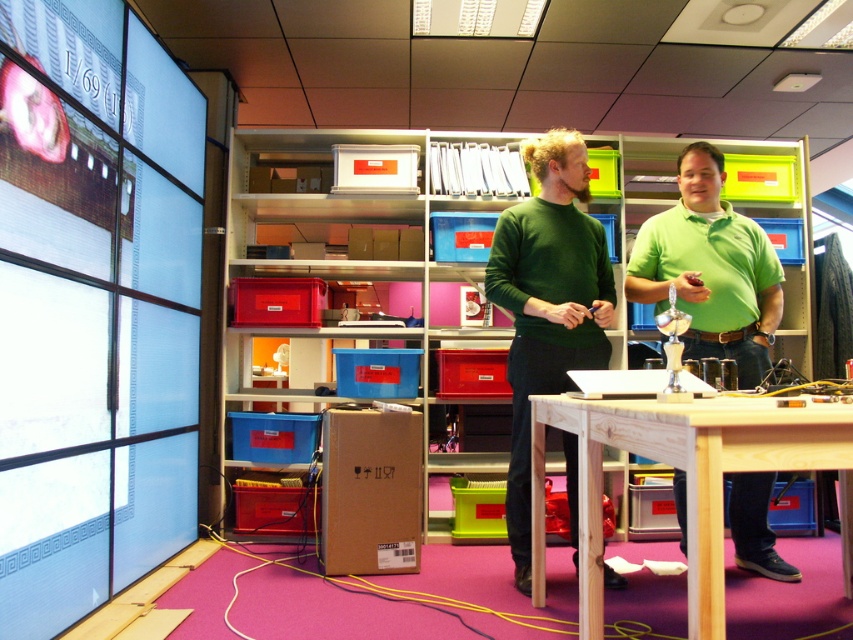
Looking at this image, does light brown wood table at center have a greater width compared to green sweater at center?

Indeed, light brown wood table at center has a greater width compared to green sweater at center.

Who is higher up, light brown wood table at center or green sweater at center?

green sweater at center is higher up.

Image resolution: width=853 pixels, height=640 pixels. What do you see at coordinates (686, 481) in the screenshot? I see `light brown wood table at center` at bounding box center [686, 481].

Image resolution: width=853 pixels, height=640 pixels. I want to click on light brown wood table at center, so click(686, 481).

Is point (492, 300) positioned behind point (643, 224)?

That is False.

Measure the distance from green sweater at center to green matte shirt at center.

green sweater at center and green matte shirt at center are 16.58 inches apart from each other.

Locate an element on the screen. green sweater at center is located at coordinates (547, 305).

What do you see at coordinates (686, 481) in the screenshot?
I see `light brown wood table at center` at bounding box center [686, 481].

Between light brown wood table at center and green matte shirt at center, which one appears on the right side from the viewer's perspective?

green matte shirt at center is more to the right.

Identify the location of light brown wood table at center. The height and width of the screenshot is (640, 853). (686, 481).

At what (x,y) coordinates should I click in order to perform the action: click on light brown wood table at center. Please return your answer as a coordinate pair (x, y). Looking at the image, I should click on (686, 481).